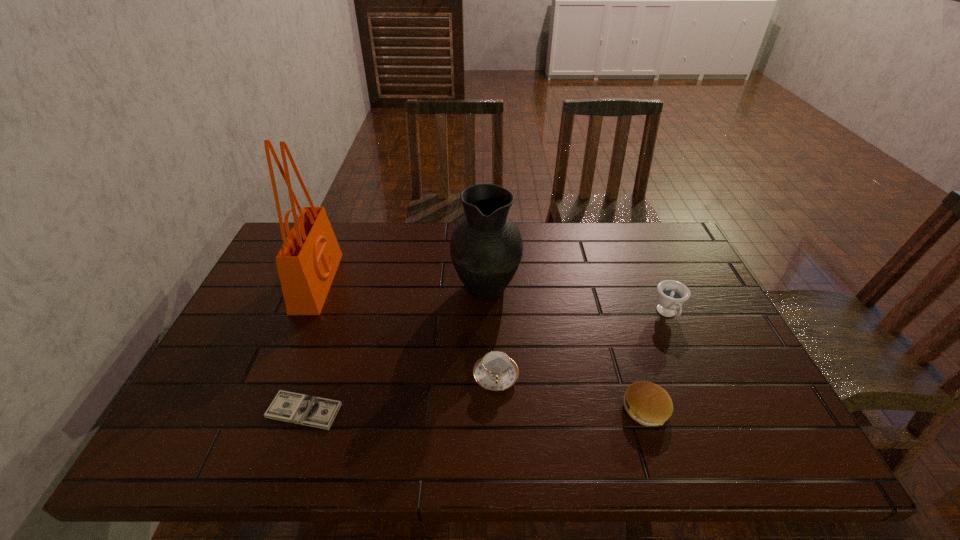
I want to click on free space that is in between the taller teacup and the shorter teacup, so point(582,345).

Find the location of a particular element. This screenshot has width=960, height=540. free space between the tallest object and the patty is located at coordinates (481, 346).

At what (x,y) coordinates should I click in order to perform the action: click on free space between the nearer teacup and the patty. Please return your answer as a coordinate pair (x, y). Looking at the image, I should click on (571, 393).

Locate an element on the screen. This screenshot has width=960, height=540. empty location between the pitcher and the right teacup is located at coordinates (577, 300).

This screenshot has height=540, width=960. Identify the location of free space between the nearer teacup and the second object from right to left. (571, 393).

Identify the location of free space that is in between the shorter teacup and the pitcher. (491, 331).

Locate an element on the screen. This screenshot has width=960, height=540. empty location between the second object from right to left and the second tallest object is located at coordinates (565, 347).

You are a GUI agent. You are given a task and a screenshot of the screen. Output one action in this format:
    pyautogui.click(x=<x>, y=<y>)
    Task: Click on the object that stands as the fifth closest to the pitcher
    The width and height of the screenshot is (960, 540).
    Given the screenshot: What is the action you would take?
    pyautogui.click(x=671, y=296)

You are a GUI agent. You are given a task and a screenshot of the screen. Output one action in this format:
    pyautogui.click(x=<x>, y=<y>)
    Task: Click on the fourth closest object to the second object from right to left
    This screenshot has width=960, height=540.
    Given the screenshot: What is the action you would take?
    pyautogui.click(x=318, y=412)

Locate an element on the screen. free space in the image that satisfies the following two spatial constraints: 1. on the logo side of the tote bag; 2. on the back side of the shortest object is located at coordinates (264, 410).